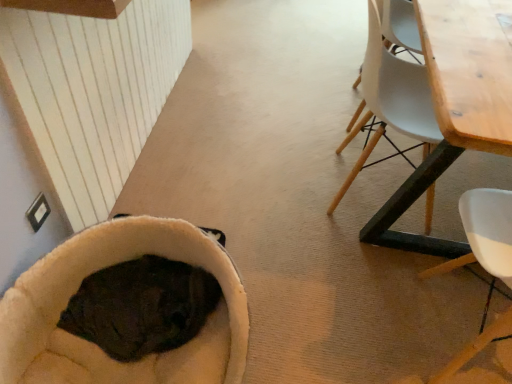
Question: From a real-world perspective, is wooden table at right above or below wooden chair at right?

Choices:
 (A) above
 (B) below

Answer: (A)

Question: Based on their sizes in the image, would you say wooden table at right is bigger or smaller than wooden chair at right?

Choices:
 (A) small
 (B) big

Answer: (B)

Question: Considering the real-world distances, which object is closest to the soft beige bean bag at lower left?

Choices:
 (A) wooden chair at right
 (B) wooden table at right

Answer: (A)

Question: Which of these objects is positioned farthest from the wooden chair at right?

Choices:
 (A) soft beige bean bag at lower left
 (B) wooden table at right

Answer: (A)